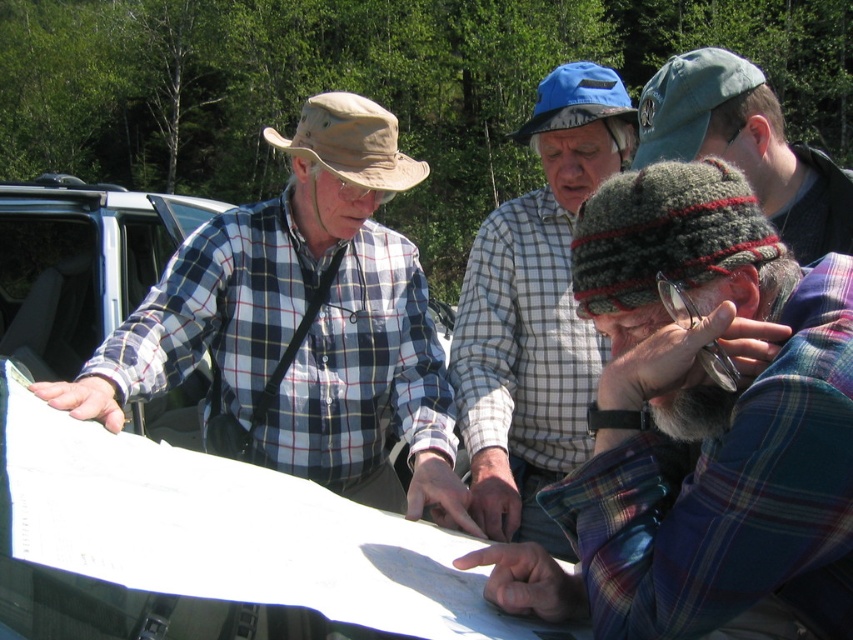
You are standing in front of the group examining the map. You need to place a small marker on the map. The marker must be placed on the point closer to you. Which point should you choose between point (x=634, y=394) and point (x=473, y=316)?

You should place the marker on point (x=634, y=394) because it is closer to you than point (x=473, y=316) according to the description.

Where is the plaid shirt at left located in the image?

The plaid shirt at left is located at point (303, 323) in the image.

You are a photographer trying to capture a group photo of the plaid shirt at left and the plaid shirt at center. Based on their heights, which one should you position closer to the camera to ensure both appear equally tall in the photo?

The plaid shirt at left is not as tall as the plaid shirt at center. To make them appear equally tall in the photo, position the plaid shirt at left closer to the camera since it is shorter, balancing their apparent heights.